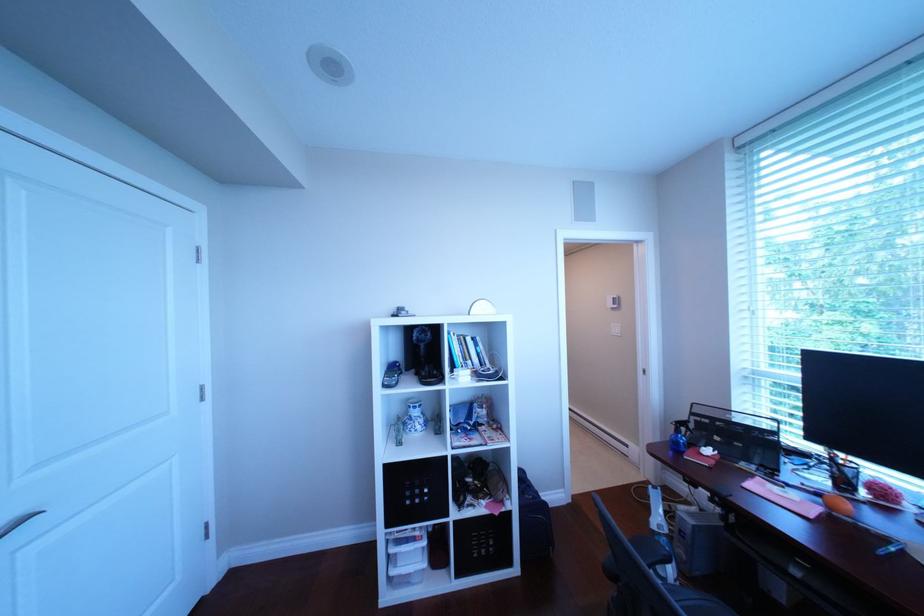
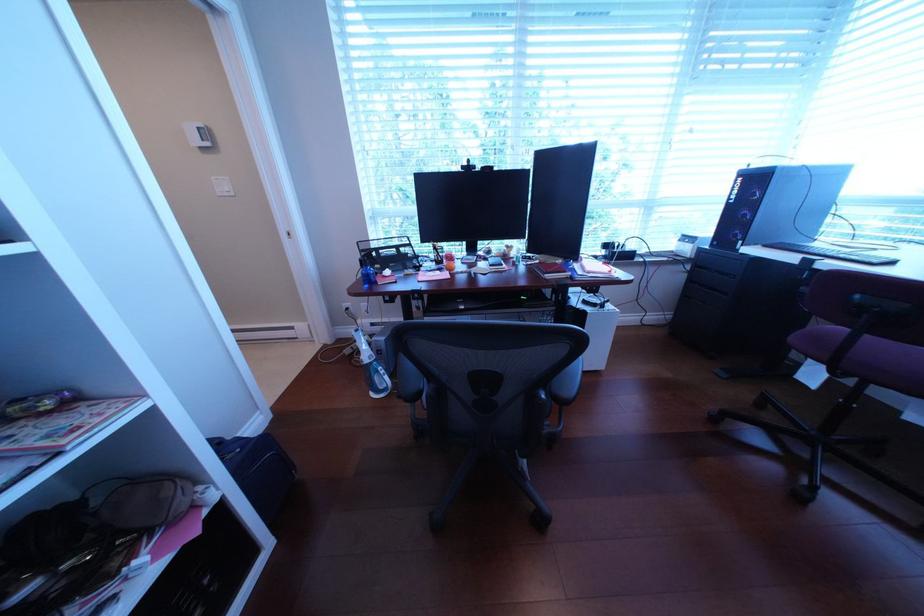
The first image is from the beginning of the video and the second image is from the end. How did the camera likely rotate when shooting the video?

The camera rotated toward right-down.